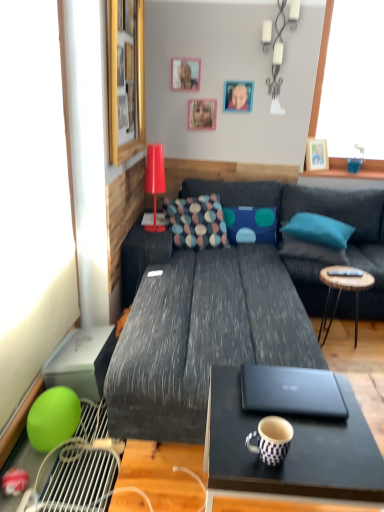
Question: From a real-world perspective, is blue and white checkered coffee cup at lower center over dark gray fabric couch at center?

Choices:
 (A) no
 (B) yes

Answer: (B)

Question: From the image's perspective, is blue and white checkered coffee cup at lower center on top of dark gray fabric couch at center?

Choices:
 (A) no
 (B) yes

Answer: (A)

Question: Does blue and white checkered coffee cup at lower center come behind dark gray fabric couch at center?

Choices:
 (A) no
 (B) yes

Answer: (A)

Question: Considering the relative positions of blue and white checkered coffee cup at lower center and dark gray fabric couch at center in the image provided, is blue and white checkered coffee cup at lower center to the right of dark gray fabric couch at center from the viewer's perspective?

Choices:
 (A) no
 (B) yes

Answer: (B)

Question: From the image's perspective, is blue and white checkered coffee cup at lower center beneath dark gray fabric couch at center?

Choices:
 (A) no
 (B) yes

Answer: (B)

Question: From a real-world perspective, is blue and white checkered coffee cup at lower center physically below dark gray fabric couch at center?

Choices:
 (A) yes
 (B) no

Answer: (B)

Question: Is blue and white checkered coffee cup at lower center oriented towards blue fabric pillow at center, arranged as the 2th pillow when viewed from the left?

Choices:
 (A) yes
 (B) no

Answer: (B)

Question: Is blue and white checkered coffee cup at lower center further to the viewer compared to blue fabric pillow at center, acting as the 3th pillow starting from the right?

Choices:
 (A) no
 (B) yes

Answer: (A)

Question: Does blue and white checkered coffee cup at lower center appear on the right side of blue fabric pillow at center, arranged as the 2th pillow when viewed from the left?

Choices:
 (A) yes
 (B) no

Answer: (B)

Question: Is blue and white checkered coffee cup at lower center bigger than blue fabric pillow at center, acting as the 3th pillow starting from the right?

Choices:
 (A) no
 (B) yes

Answer: (A)

Question: Does blue and white checkered coffee cup at lower center have a lesser height compared to blue fabric pillow at center, acting as the 3th pillow starting from the right?

Choices:
 (A) yes
 (B) no

Answer: (A)

Question: From a real-world perspective, does blue and white checkered coffee cup at lower center sit lower than blue fabric pillow at center, acting as the 3th pillow starting from the right?

Choices:
 (A) yes
 (B) no

Answer: (B)

Question: Can you confirm if blue fabric portrait at upper center is wider than wooden picture frame at upper right, which ranks as the 1th picture frame in right-to-left order?

Choices:
 (A) yes
 (B) no

Answer: (B)